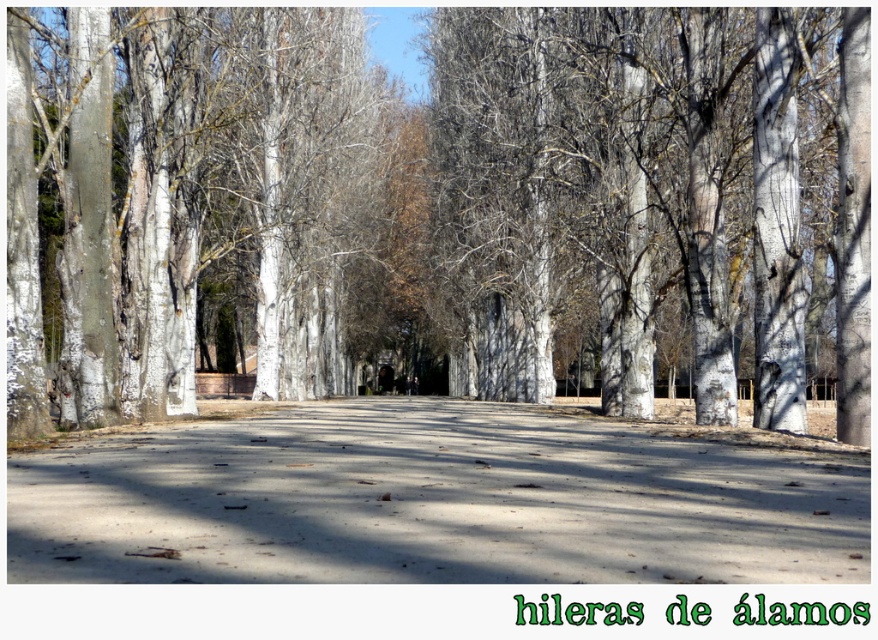
You are standing on the pathway and see the smooth white tree at center and the white smooth tree at left. Which tree is positioned more to the east if the pathway runs from west to east?

The white smooth tree at left is positioned more to the east than the smooth white tree at center because the pathway runs west to east, so the tree on the left would be further east.

You are walking along the pathway and want to take a photo of both the smooth white tree at center and the white smooth tree at left. Which tree should you stand closer to in order to capture both in a single frame?

You should stand closer to the white smooth tree at left because it is smaller in size than the smooth white tree at center, allowing both to fit within the camera frame when positioned appropriately.

You are a hiker carrying a 2.5 meter long wooden pole horizontally. You come across the smooth white tree at center and the smooth concrete path at center. Can you pass the pole through the space between the tree and the path without tilting it?

The smooth white tree at center is wider than the smooth concrete path at center. Since the tree is wider, the space between them is narrower than the path itself. The pole is 2.5 meters long, but the question is about width. Wait, maybe I need to clarify. The question is about passing a horizontal pole through the space between the tree and the path. Hmm, perhaps the path is narrower than the tree? Wait, the description says the tree is wider than the path. So the path is narrower. If the path is narrower,